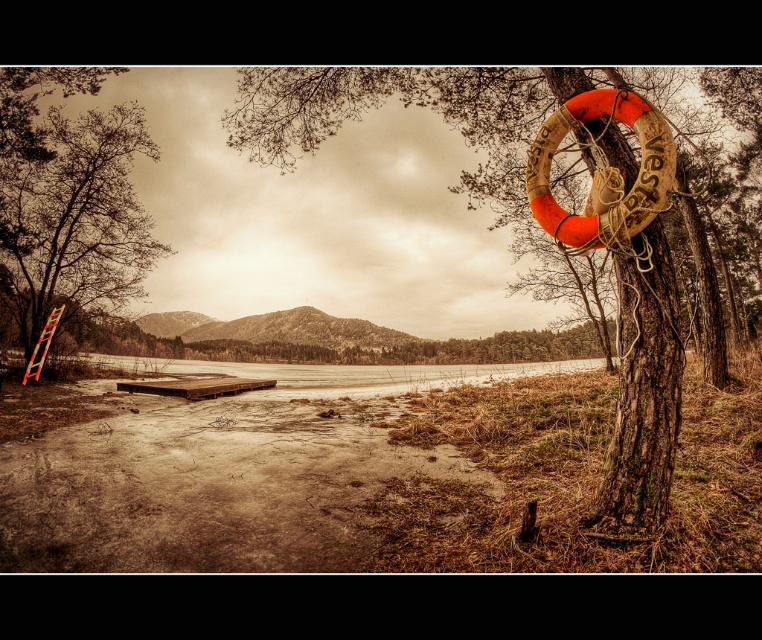
Looking at this image, who is lower down, wooden textured tree trunk at right or brown rough ladder at left?

wooden textured tree trunk at right

Is wooden textured tree trunk at right thinner than brown rough ladder at left?

No.

Where is `wooden textured tree trunk at right`? The height and width of the screenshot is (640, 762). wooden textured tree trunk at right is located at coordinates (540, 220).